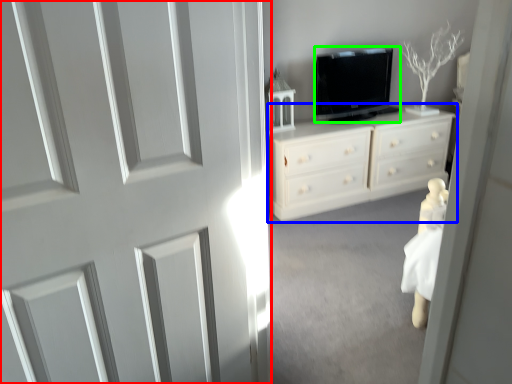
Question: Which object is the farthest from door (highlighted by a red box)? Choose among these: chest of drawers (highlighted by a blue box) or television (highlighted by a green box).

Choices:
 (A) chest of drawers
 (B) television

Answer: (B)